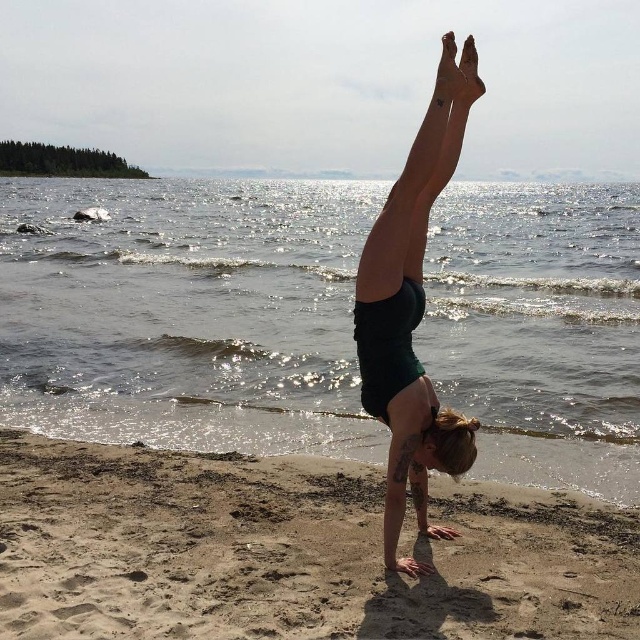
You are a photographer positioned on the beach. You want to capture a photo where the green matte shorts at center and the glistening water at center are both clearly visible. Based on their positions, which object should be closer to the camera to ensure both are in focus?

The glistening water at center should be closer to the camera because the green matte shorts at center is behind it. By focusing on the glistening water at center, both objects will be in focus as the shorts are behind the water.

You are standing at the edge of the beach and see two points marked in the image. One is at coordinates point (324,310) and the other at point (444,65). Which point is closer to you?

Point (324,310) is further to the viewer than point (444,65), so the point at (444,65) is closer to you.